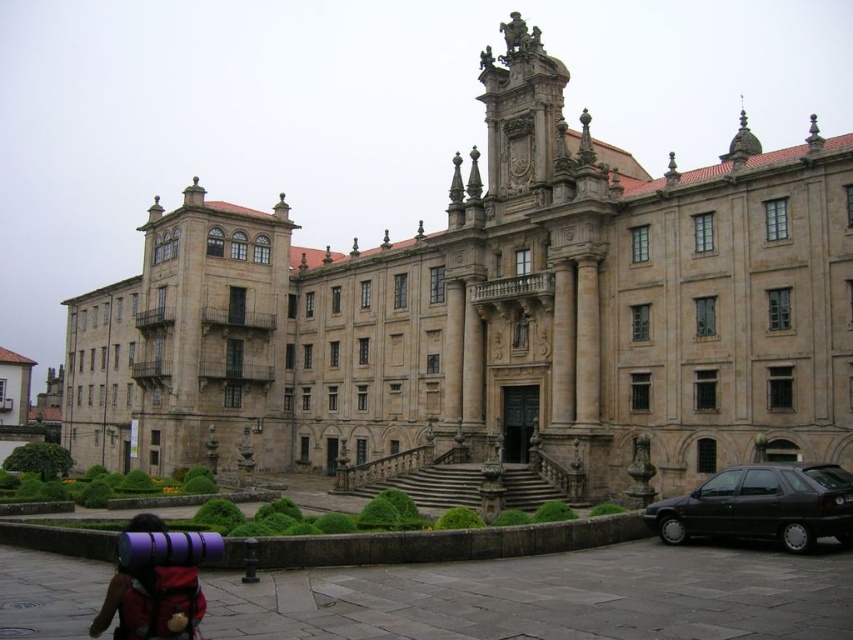
Does black matte hatchback at lower right come behind purple fabric backpack at lower left?

Yes, it is behind purple fabric backpack at lower left.

Find the location of a particular element. Image resolution: width=853 pixels, height=640 pixels. black matte hatchback at lower right is located at coordinates (761, 506).

Between beige stone palace at center and purple fabric backpack at lower left, which one is positioned lower?

purple fabric backpack at lower left is lower down.

Who is shorter, beige stone palace at center or purple fabric backpack at lower left?

purple fabric backpack at lower left

Between point (132, 320) and point (170, 573), which one is positioned behind?

The point (132, 320) is behind.

Locate an element on the screen. beige stone palace at center is located at coordinates (492, 314).

Between beige stone palace at center and black matte hatchback at lower right, which one appears on the left side from the viewer's perspective?

From the viewer's perspective, beige stone palace at center appears more on the left side.

Measure the distance between beige stone palace at center and black matte hatchback at lower right.

They are 31.33 meters apart.

Measure the distance between point (537, 321) and camera.

They are 67.50 meters apart.

Identify the location of beige stone palace at center. This screenshot has width=853, height=640. [492, 314].